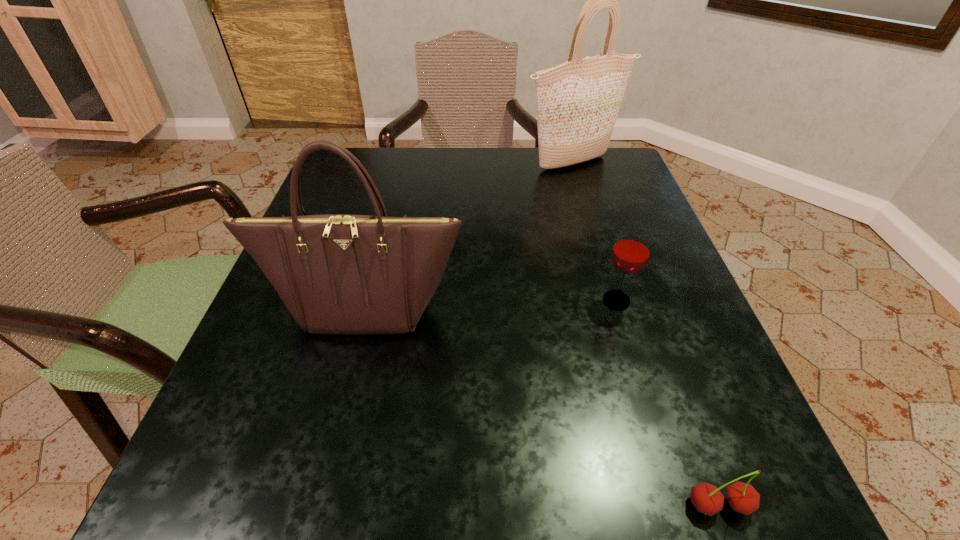
In the image, there is a desktop. Identify the location of free region at the left edge. (365, 201).

Locate an element on the screen. The image size is (960, 540). free location at the right edge of the desktop is located at coordinates (719, 409).

You are a GUI agent. You are given a task and a screenshot of the screen. Output one action in this format:
    pyautogui.click(x=<x>, y=<y>)
    Task: Click on the vacant space at the far left corner
    The width and height of the screenshot is (960, 540).
    Given the screenshot: What is the action you would take?
    pyautogui.click(x=323, y=187)

This screenshot has width=960, height=540. Identify the location of vacant position at the far right corner of the desktop. (580, 165).

The height and width of the screenshot is (540, 960). Find the location of `free space between the cherry and the farthest object`. free space between the cherry and the farthest object is located at coordinates (645, 334).

I want to click on free area in between the second shortest object and the handbag, so click(x=491, y=305).

Find the location of a particular element. Image resolution: width=960 pixels, height=540 pixels. vacant space in between the leftmost object and the cherry is located at coordinates (542, 407).

This screenshot has height=540, width=960. I want to click on free space that is in between the shortest object and the handbag, so click(x=542, y=407).

Find the location of a particular element. This screenshot has height=540, width=960. free space between the glass and the farthest object is located at coordinates (594, 232).

The width and height of the screenshot is (960, 540). What are the coordinates of `empty space between the third tallest object and the leftmost object` in the screenshot? It's located at [491, 305].